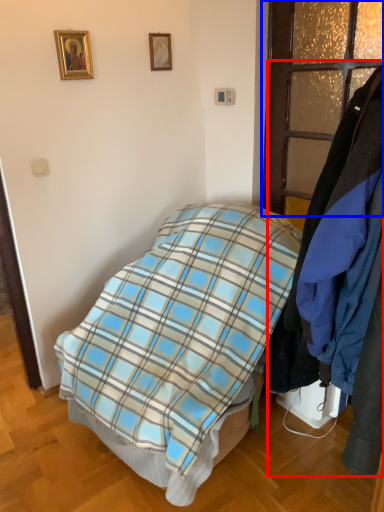
Question: Which of the following is the farthest to the observer, closet (highlighted by a red box) or glass door (highlighted by a blue box)?

Choices:
 (A) closet
 (B) glass door

Answer: (B)